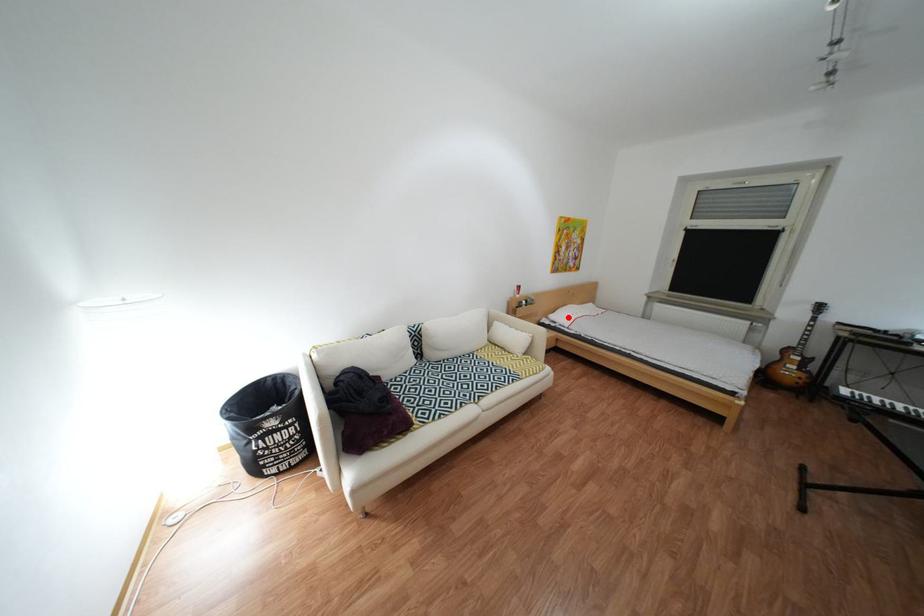
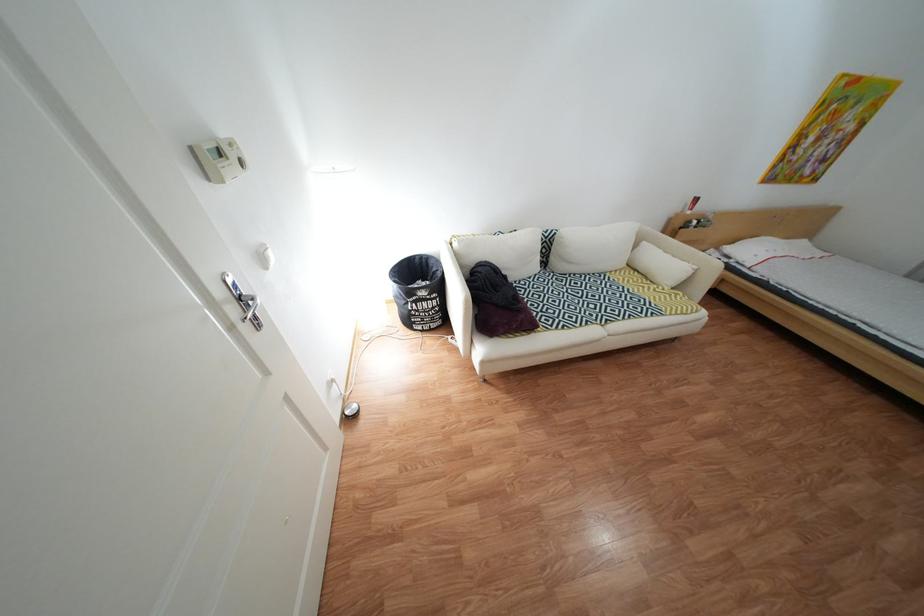
In the second image, find the point that corresponds to the highlighted location in the first image.

(744, 249)